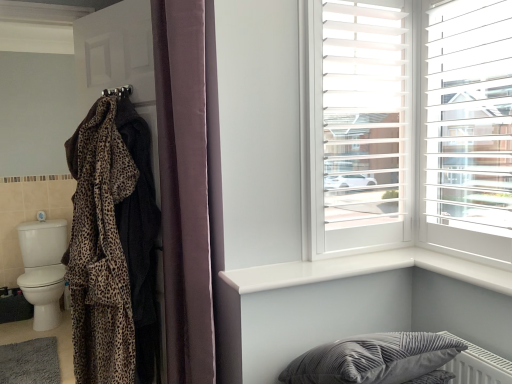
This screenshot has height=384, width=512. What do you see at coordinates (373, 359) in the screenshot?
I see `velvet gray pillow at lower right` at bounding box center [373, 359].

What are the coordinates of `leopard print robe at left` in the screenshot? It's located at (199, 174).

The image size is (512, 384). Describe the element at coordinates (358, 125) in the screenshot. I see `white plastic window frame at upper right` at that location.

What do you see at coordinates (112, 246) in the screenshot? I see `leopard print fabric at left` at bounding box center [112, 246].

Identify the location of velvet gray pillow at lower right. (373, 359).

From the image's perspective, which one is positioned lower, leopard print robe at left or soft gray carpet at lower left?

soft gray carpet at lower left, from the image's perspective.

Which is more to the right, leopard print robe at left or soft gray carpet at lower left?

leopard print robe at left.

Which is in front, leopard print robe at left or soft gray carpet at lower left?

leopard print robe at left.

Is leopard print robe at left taller than soft gray carpet at lower left?

Indeed, leopard print robe at left has a greater height compared to soft gray carpet at lower left.

Looking at this image, from the image's perspective, which is above, leopard print robe at left or velvet curtain at center?

From the image's view, velvet curtain at center is above.

From a real-world perspective, is leopard print robe at left located higher than velvet curtain at center?

No, from a real-world perspective, leopard print robe at left is not above velvet curtain at center.

Considering the relative sizes of leopard print robe at left and velvet curtain at center in the image provided, is leopard print robe at left taller than velvet curtain at center?

Yes.

Is white glossy window sill at upper right located within velvet curtain at center?

That's incorrect, white glossy window sill at upper right is not inside velvet curtain at center.

Could you tell me if velvet curtain at center is facing white glossy window sill at upper right?

No, velvet curtain at center does not turn towards white glossy window sill at upper right.

Between velvet curtain at center and white glossy window sill at upper right, which one appears on the left side from the viewer's perspective?

velvet curtain at center is more to the left.

From the image's perspective, does velvet curtain at center appear higher than white glossy window sill at upper right?

Yes, from the image's perspective, velvet curtain at center is on top of white glossy window sill at upper right.

Can you see leopard print fabric at left touching white plastic blinds at upper right?

There is a gap between leopard print fabric at left and white plastic blinds at upper right.

Considering the positions of objects leopard print fabric at left and white plastic blinds at upper right in the image provided, who is behind, leopard print fabric at left or white plastic blinds at upper right?

leopard print fabric at left is further away from the camera.

Based on the photo, from the image's perspective, is leopard print fabric at left located above or below white plastic blinds at upper right?

From the image's perspective, leopard print fabric at left appears below white plastic blinds at upper right.

Which of these two, leopard print fabric at left or white plastic blinds at upper right, is smaller?

white plastic blinds at upper right.

Is leopard print fabric at left facing towards white glossy window sill at upper right?

No, leopard print fabric at left is not aimed at white glossy window sill at upper right.

From a real-world perspective, is leopard print fabric at left positioned above or below white glossy window sill at upper right?

leopard print fabric at left is above white glossy window sill at upper right.

From the image's perspective, would you say leopard print fabric at left is shown under white glossy window sill at upper right?

Incorrect, from the image's perspective, leopard print fabric at left is higher than white glossy window sill at upper right.

Between leopard print fabric at left and white glossy window sill at upper right, which one has larger size?

With larger size is leopard print fabric at left.

How many degrees apart are the facing directions of white glossy window sill at upper right and white plastic blinds at upper right?

The facing directions of white glossy window sill at upper right and white plastic blinds at upper right are 91.2 degrees apart.

Is point (289, 278) closer to camera compared to point (480, 0)?

Yes, it is.

Would you consider white glossy window sill at upper right to be distant from white plastic blinds at upper right?

No, white glossy window sill at upper right is not far away from white plastic blinds at upper right.

Is white glossy window sill at upper right smaller than white plastic blinds at upper right?

Correct, white glossy window sill at upper right occupies less space than white plastic blinds at upper right.

Looking at the image, does white plastic blinds at upper right seem bigger or smaller compared to soft gray carpet at lower left?

white plastic blinds at upper right is bigger than soft gray carpet at lower left.

From a real-world perspective, which object rests below the other?

soft gray carpet at lower left, from a real-world perspective.

From the picture: Considering the positions of objects white plastic blinds at upper right and soft gray carpet at lower left in the image provided, who is more to the left, white plastic blinds at upper right or soft gray carpet at lower left?

From the viewer's perspective, soft gray carpet at lower left appears more on the left side.

Between point (441, 214) and point (0, 361), which one is positioned in front?

The point (441, 214) is more forward.

You are a GUI agent. You are given a task and a screenshot of the screen. Output one action in this format:
    pyautogui.click(x=<x>, y=<y>)
    Task: Click on the mat below the leopard print robe at left (from a real-world perspective)
    
    Given the screenshot: What is the action you would take?
    pyautogui.click(x=30, y=362)

The width and height of the screenshot is (512, 384). In order to click on closet on the left side of velvet curtain at center in this screenshot , I will do `click(199, 174)`.

Looking at the image, which one is located further to white plastic window frame at upper right, leopard print fabric robe at left or velvet curtain at center?

The object further to white plastic window frame at upper right is leopard print fabric robe at left.

Estimate the real-world distances between objects in this image. Which object is closer to white plastic blinds at upper right, velvet curtain at center or soft gray carpet at lower left?

velvet curtain at center is positioned closer to the anchor white plastic blinds at upper right.

Estimate the real-world distances between objects in this image. Which object is closer to velvet gray pillow at lower right, white plastic blinds at upper right or leopard print robe at left?

Based on the image, leopard print robe at left appears to be nearer to velvet gray pillow at lower right.

When comparing their distances from leopard print robe at left, does velvet gray pillow at lower right or white glossy window sill at upper right seem further?

The object further to leopard print robe at left is velvet gray pillow at lower right.

When comparing their distances from white plastic window frame at upper right, does white glossy window sill at upper right or soft gray carpet at lower left seem further?

Based on the image, soft gray carpet at lower left appears to be further to white plastic window frame at upper right.

Which object lies further to the anchor point white glossy window sill at upper right, white plastic window frame at upper right or soft gray carpet at lower left?

soft gray carpet at lower left is further to white glossy window sill at upper right.

Looking at the image, which one is located further to leopard print robe at left, leopard print fabric robe at left or white plastic blinds at upper right?

white plastic blinds at upper right is positioned further to the anchor leopard print robe at left.

Considering their positions, is leopard print robe at left positioned further to velvet curtain at center than leopard print fabric robe at left?

leopard print fabric robe at left is further to velvet curtain at center.

You are a GUI agent. You are given a task and a screenshot of the screen. Output one action in this format:
    pyautogui.click(x=<x>, y=<y>)
    Task: Click on the closet between soft gray carpet at lower left and white glossy window sill at upper right in the horizontal direction
    This screenshot has height=384, width=512.
    Given the screenshot: What is the action you would take?
    pyautogui.click(x=199, y=174)

Where is `pillow between soft gray carpet at lower left and white plastic blinds at upper right`? pillow between soft gray carpet at lower left and white plastic blinds at upper right is located at coordinates pyautogui.click(x=373, y=359).

The width and height of the screenshot is (512, 384). I want to click on window sill between velvet curtain at center and white plastic window frame at upper right from left to right, so [365, 270].

You are a GUI agent. You are given a task and a screenshot of the screen. Output one action in this format:
    pyautogui.click(x=<x>, y=<y>)
    Task: Click on the robe between soft gray carpet at lower left and velvet curtain at center
    The height and width of the screenshot is (384, 512).
    Given the screenshot: What is the action you would take?
    pyautogui.click(x=141, y=242)